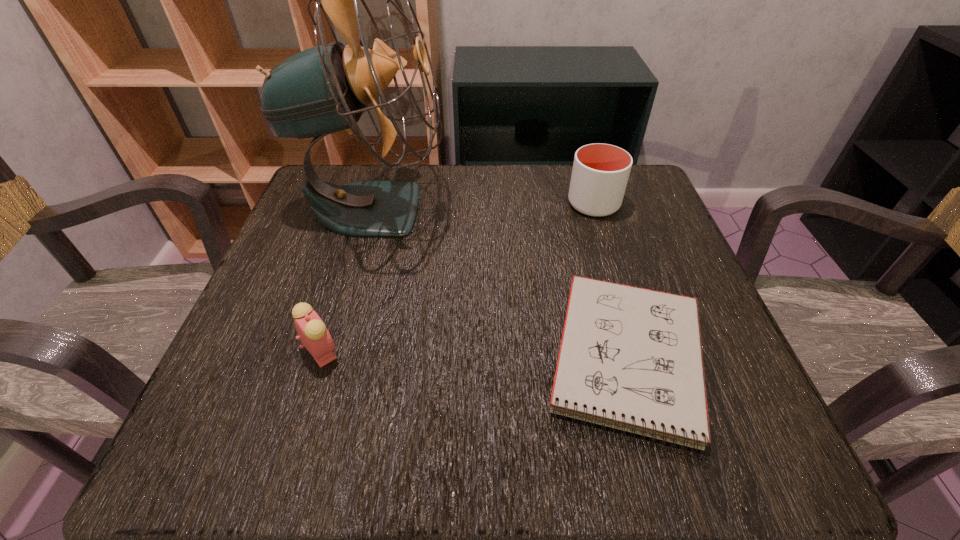
The image size is (960, 540). In order to click on object positioned at the near edge in this screenshot , I will do `click(630, 358)`.

Locate an element on the screen. fan present at the left edge is located at coordinates (324, 89).

Locate an element on the screen. The width and height of the screenshot is (960, 540). alarm clock that is at the left edge is located at coordinates (314, 336).

The width and height of the screenshot is (960, 540). In order to click on cup that is at the right edge in this screenshot , I will do (x=600, y=173).

Locate an element on the screen. This screenshot has width=960, height=540. notepad situated at the right edge is located at coordinates (630, 358).

Find the location of a particular element. The width and height of the screenshot is (960, 540). object at the far left corner is located at coordinates (324, 89).

Where is `object present at the far right corner`? This screenshot has width=960, height=540. object present at the far right corner is located at coordinates (600, 173).

Locate an element on the screen. object that is at the near right corner is located at coordinates (630, 358).

The width and height of the screenshot is (960, 540). Find the location of `free space at the far edge of the desktop`. free space at the far edge of the desktop is located at coordinates (557, 206).

Image resolution: width=960 pixels, height=540 pixels. Find the location of `free space at the near edge of the desktop`. free space at the near edge of the desktop is located at coordinates (537, 467).